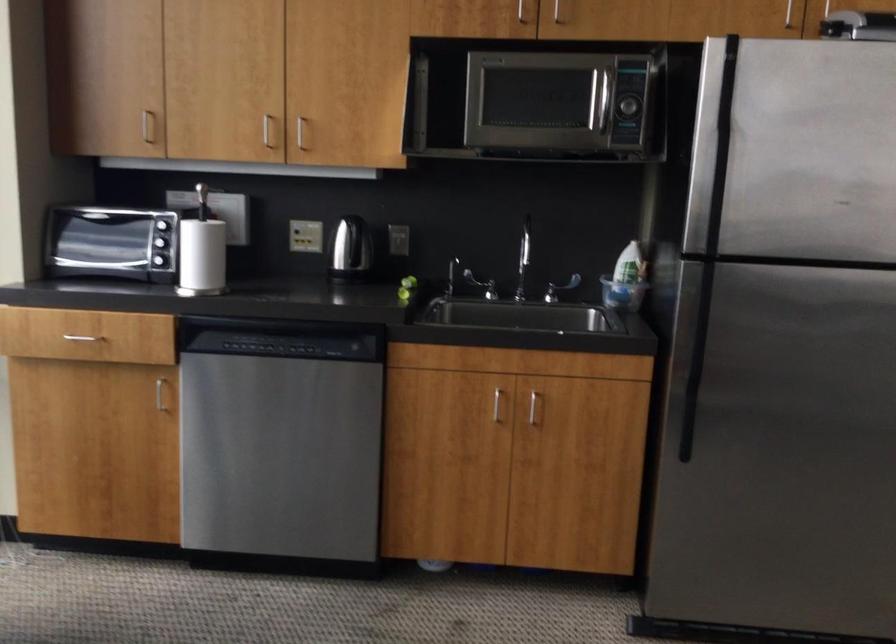
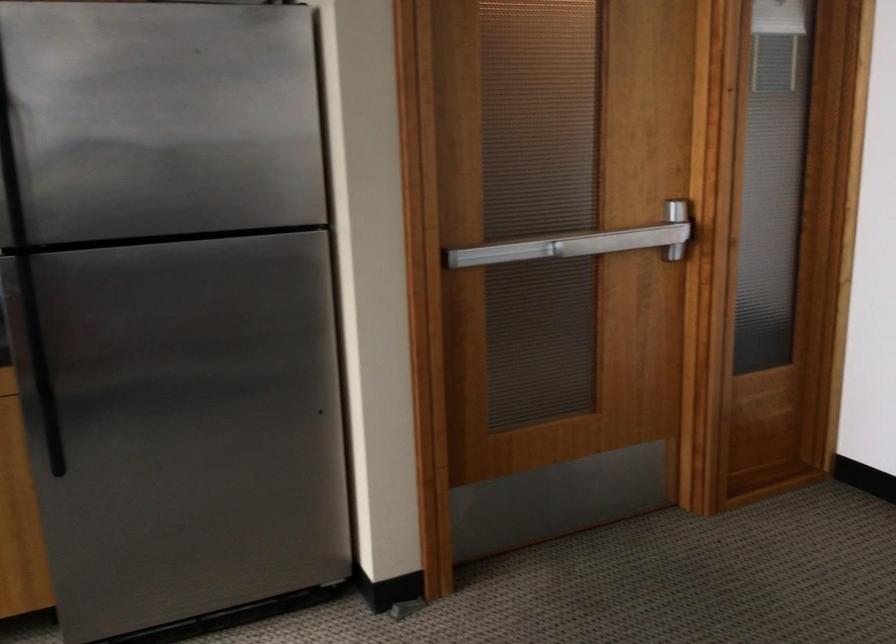
Question: The first image is from the beginning of the video and the second image is from the end. How did the camera likely rotate when shooting the video?

Choices:
 (A) Left
 (B) Right
 (C) Up
 (D) Down

Answer: (B)